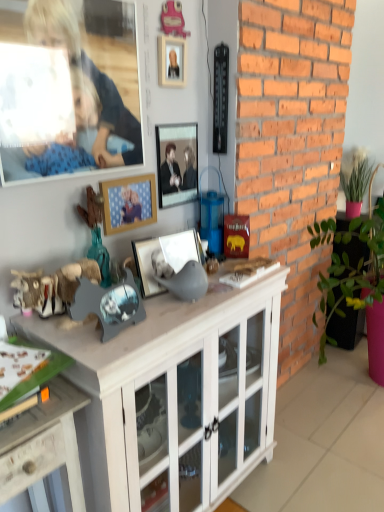
At what (x,y) coordinates should I click in order to perform the action: click on unoccupied area in front of matte silver picture frame at center, the 1th picture frame ordered from the bottom. Please return your answer as a coordinate pair (x, y). Image resolution: width=384 pixels, height=512 pixels. Looking at the image, I should click on [x=174, y=314].